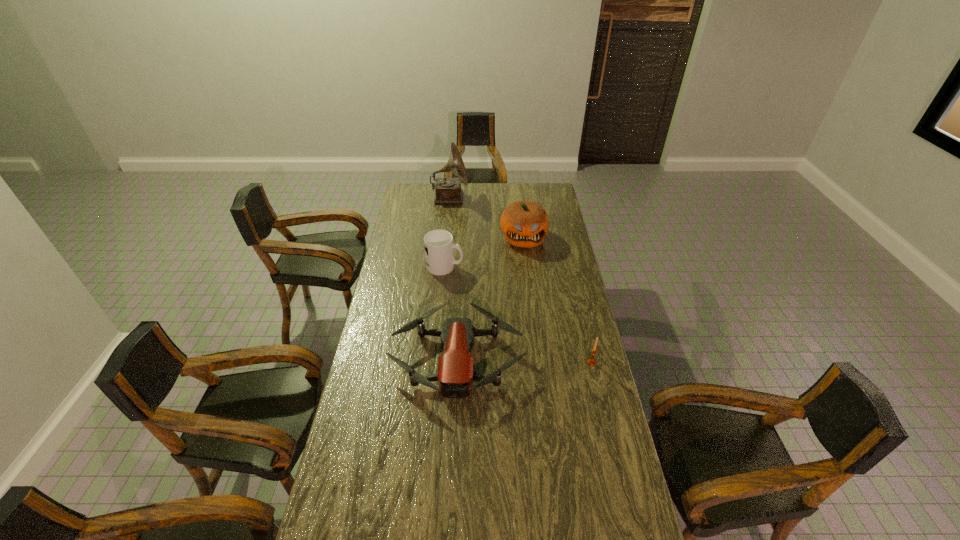
The height and width of the screenshot is (540, 960). Identify the location of phonograph record. (448, 190).

At what (x,y) coordinates should I click in order to perform the action: click on the farthest object. Please return your answer as a coordinate pair (x, y). This screenshot has width=960, height=540. Looking at the image, I should click on (448, 190).

Identify the location of pumpkin. (524, 224).

The width and height of the screenshot is (960, 540). I want to click on the fourth shortest object, so click(524, 224).

Where is `mug`? Image resolution: width=960 pixels, height=540 pixels. mug is located at coordinates (439, 245).

Locate an element on the screen. the third nearest object is located at coordinates (439, 245).

Identify the location of the rightmost object. This screenshot has width=960, height=540. (591, 361).

Image resolution: width=960 pixels, height=540 pixels. In order to click on candle_holder in this screenshot , I will do `click(591, 361)`.

Identify the location of drone. Image resolution: width=960 pixels, height=540 pixels. (455, 374).

Where is `vacant space located on the horn of the tallest object`? This screenshot has width=960, height=540. vacant space located on the horn of the tallest object is located at coordinates (532, 198).